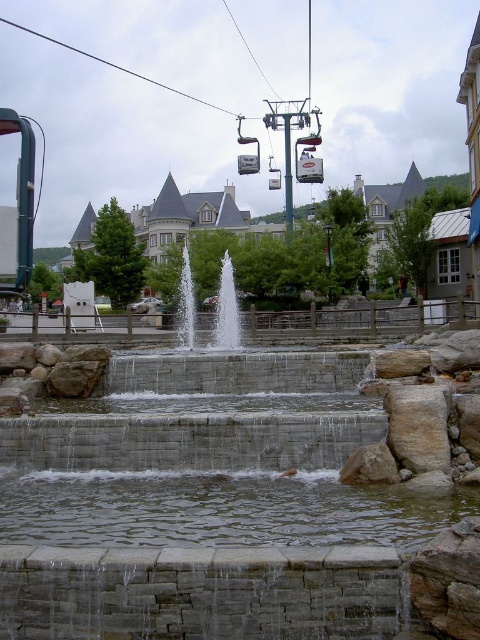
Can you confirm if clear water at center is positioned above metallic cable car at center?

Actually, clear water at center is below metallic cable car at center.

Between clear water at center and metallic cable car at center, which one is positioned higher?

Positioned higher is metallic cable car at center.

Is point (377, 531) farther from viewer compared to point (149, 308)?

That is False.

The height and width of the screenshot is (640, 480). Identify the location of clear water at center. (216, 509).

Which is in front, point (179, 337) or point (155, 300)?

Point (179, 337)

Does clear glass waterfall at center have a greater width compared to metallic cable car at center?

No.

Which is in front, point (182, 317) or point (156, 298)?

Point (182, 317) is more forward.

In order to click on clear glass waterfall at center in this screenshot , I will do `click(186, 304)`.

Which of these two, clear water at center or white stone waterfall at center, stands shorter?

With less height is clear water at center.

Between point (214, 518) and point (239, 321), which one is positioned in front?

Positioned in front is point (214, 518).

Is point (446, 506) in front of point (226, 321)?

That is True.

This screenshot has height=640, width=480. I want to click on clear water at center, so click(216, 509).